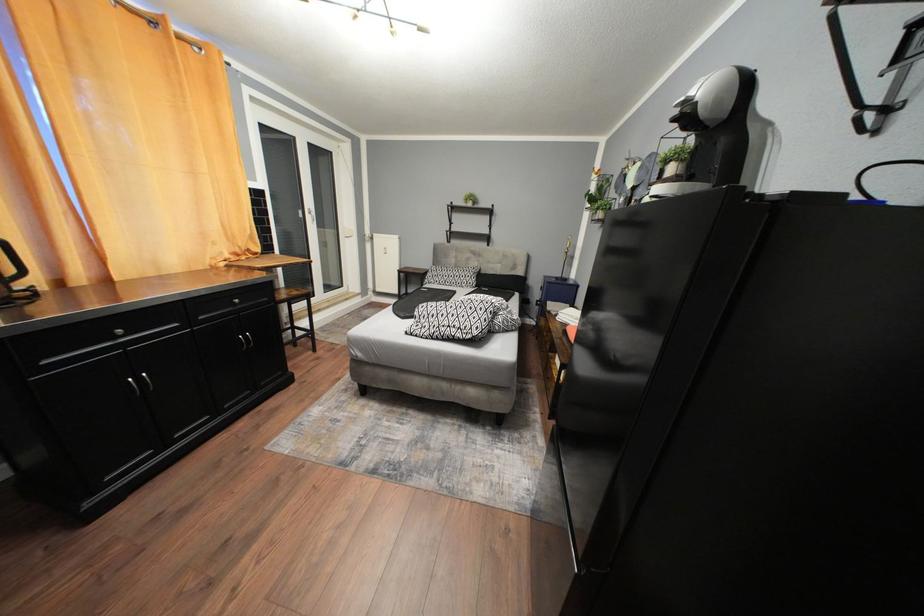
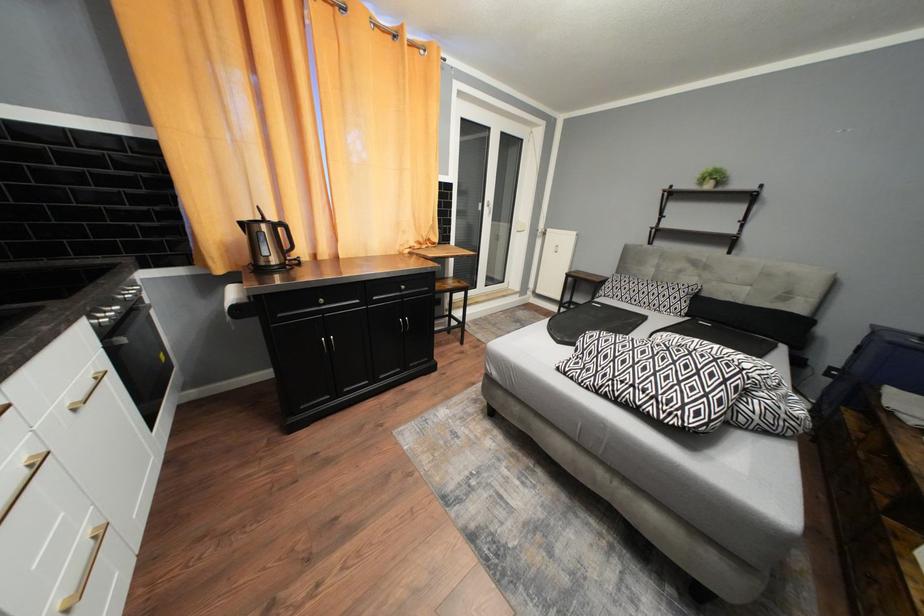
Question: The camera is either moving clockwise (left) or counter-clockwise (right) around the object. The first image is from the beginning of the video and the second image is from the end. Is the camera moving left or right when shooting the video?

Choices:
 (A) Left
 (B) Right

Answer: (B)